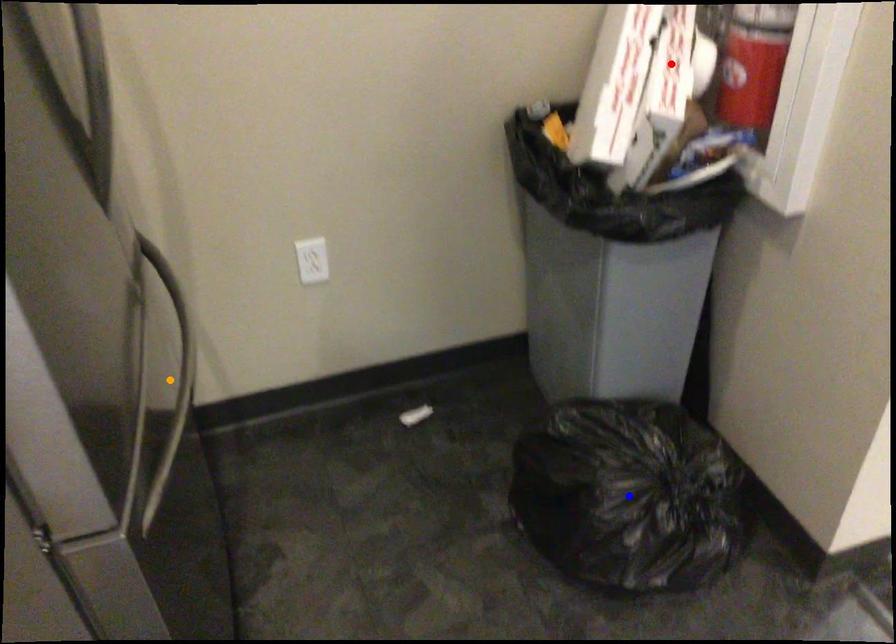
Order these from nearest to farthest:
- blue point
- red point
- orange point

1. red point
2. blue point
3. orange point